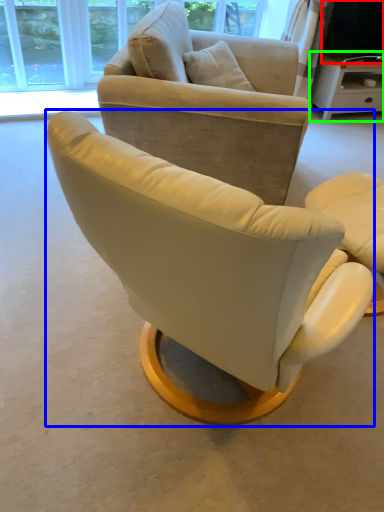
Question: Which is farther away from television (highlighted by a red box)? chair (highlighted by a blue box) or desk (highlighted by a green box)?

Choices:
 (A) chair
 (B) desk

Answer: (A)